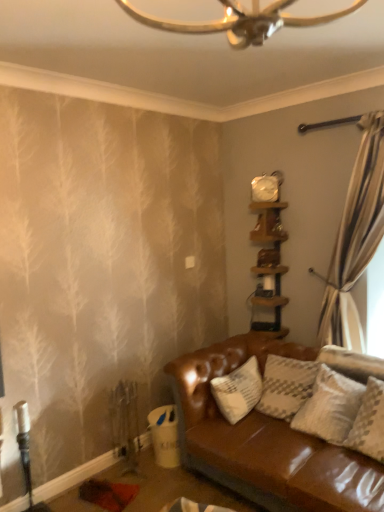
In order to click on white glossy clock at upper center in this screenshot , I will do `click(265, 188)`.

Which object is further away from the camera, wooden shelf at upper right, the second shelf positioned from the bottom, or white glossy clock at upper center?

white glossy clock at upper center is behind.

How different are the orientations of wooden shelf at upper right, the 1th shelf from the top, and white glossy clock at upper center in degrees?

The angular difference between wooden shelf at upper right, the 1th shelf from the top, and white glossy clock at upper center is 41.4 degrees.

Considering the relative sizes of wooden shelf at upper right, the second shelf positioned from the bottom, and white glossy clock at upper center in the image provided, is wooden shelf at upper right, the second shelf positioned from the bottom, thinner than white glossy clock at upper center?

In fact, wooden shelf at upper right, the second shelf positioned from the bottom, might be wider than white glossy clock at upper center.

Is point (277, 218) closer or farther from the camera than point (267, 185)?

Point (277, 218) is positioned farther from the camera compared to point (267, 185).

Considering the sizes of objects wooden shelf at upper right, the 1th shelf from the top, and wooden shelf at upper right, which is the first shelf from bottom to top, in the image provided, who is taller, wooden shelf at upper right, the 1th shelf from the top, or wooden shelf at upper right, which is the first shelf from bottom to top,?

Standing taller between the two is wooden shelf at upper right, which is the first shelf from bottom to top.

Is wooden shelf at upper right, the 1th shelf from the top, positioned with its back to wooden shelf at upper right, placed as the 2th shelf when sorted from top to bottom?

Correct, wooden shelf at upper right, the 1th shelf from the top, is looking away from wooden shelf at upper right, placed as the 2th shelf when sorted from top to bottom.

Is wooden shelf at upper right, the 1th shelf from the top, positioned far away from wooden shelf at upper right, placed as the 2th shelf when sorted from top to bottom?

No, wooden shelf at upper right, the 1th shelf from the top, is in close proximity to wooden shelf at upper right, placed as the 2th shelf when sorted from top to bottom.

Which object is wider, wooden shelf at upper right, the second shelf positioned from the bottom, or wooden shelf at upper right, placed as the 2th shelf when sorted from top to bottom?

Wider between the two is wooden shelf at upper right, placed as the 2th shelf when sorted from top to bottom.

Which of these two, wooden shelf at upper right, which is the first shelf from bottom to top, or wooden shelf at upper right, the second shelf positioned from the bottom, is bigger?

With larger size is wooden shelf at upper right, which is the first shelf from bottom to top.

Is wooden shelf at upper right, placed as the 2th shelf when sorted from top to bottom, in contact with wooden shelf at upper right, the 1th shelf from the top?

No.

Would you say wooden shelf at upper right, the 1th shelf from the top, is part of wooden shelf at upper right, placed as the 2th shelf when sorted from top to bottom,'s contents?

Yes, wooden shelf at upper right, placed as the 2th shelf when sorted from top to bottom, is surrounding wooden shelf at upper right, the 1th shelf from the top.

At what (x,y) coordinates should I click in order to perform the action: click on shelf above the wooden shelf at upper right, which is the first shelf from bottom to top (from the image's perspective). Please return your answer as a coordinate pair (x, y). This screenshot has height=512, width=384. Looking at the image, I should click on click(x=268, y=222).

Could you measure the distance between white glossy clock at upper center and wooden shelf at upper right, the 1th shelf from the top?

The distance of white glossy clock at upper center from wooden shelf at upper right, the 1th shelf from the top, is 5.49 inches.

Considering the sizes of objects white glossy clock at upper center and wooden shelf at upper right, the 1th shelf from the top, in the image provided, who is bigger, white glossy clock at upper center or wooden shelf at upper right, the 1th shelf from the top,?

With larger size is wooden shelf at upper right, the 1th shelf from the top.

From a real-world perspective, between white glossy clock at upper center and wooden shelf at upper right, the 1th shelf from the top, who is vertically higher?

white glossy clock at upper center, from a real-world perspective.

Is white glossy clock at upper center placed right next to wooden shelf at upper right, the 1th shelf from the top?

No, white glossy clock at upper center is not touching wooden shelf at upper right, the 1th shelf from the top.

Is wooden shelf at upper right, which is the first shelf from bottom to top, next to white glossy clock at upper center?

wooden shelf at upper right, which is the first shelf from bottom to top, and white glossy clock at upper center are clearly separated.

Which object is closer to the camera taking this photo, wooden shelf at upper right, placed as the 2th shelf when sorted from top to bottom, or white glossy clock at upper center?

wooden shelf at upper right, placed as the 2th shelf when sorted from top to bottom, is in front.

From the image's perspective, between wooden shelf at upper right, placed as the 2th shelf when sorted from top to bottom, and white glossy clock at upper center, which one is located above?

white glossy clock at upper center is shown above in the image.

The width and height of the screenshot is (384, 512). I want to click on clock on the left of the wooden shelf at upper right, which is the first shelf from bottom to top, so click(x=265, y=188).

What's the angular difference between white glossy clock at upper center and wooden shelf at upper right, which is the first shelf from bottom to top,'s facing directions?

white glossy clock at upper center and wooden shelf at upper right, which is the first shelf from bottom to top, are facing 40.6 degrees away from each other.

Between white glossy clock at upper center and wooden shelf at upper right, placed as the 2th shelf when sorted from top to bottom, which one is positioned behind?

white glossy clock at upper center.

From the image's perspective, which one is positioned lower, white glossy clock at upper center or wooden shelf at upper right, which is the first shelf from bottom to top?

From the image's view, wooden shelf at upper right, which is the first shelf from bottom to top, is below.

From a real-world perspective, which shelf is the 2nd one underneath the white glossy clock at upper center? Please provide its 2D coordinates.

[(269, 262)]

I want to click on clock located above the wooden shelf at upper right, the 1th shelf from the top (from a real-world perspective), so point(265,188).

The width and height of the screenshot is (384, 512). I want to click on shelf that is below the wooden shelf at upper right, the 1th shelf from the top (from the image's perspective), so click(269, 262).

Looking at the image, which one is located further to wooden shelf at upper right, placed as the 2th shelf when sorted from top to bottom, wooden shelf at upper right, the 1th shelf from the top, or white glossy clock at upper center?

white glossy clock at upper center is further to wooden shelf at upper right, placed as the 2th shelf when sorted from top to bottom.

Estimate the real-world distances between objects in this image. Which object is closer to wooden shelf at upper right, the 1th shelf from the top, white glossy clock at upper center or wooden shelf at upper right, which is the first shelf from bottom to top?

white glossy clock at upper center is closer to wooden shelf at upper right, the 1th shelf from the top.

Looking at the image, which one is located closer to wooden shelf at upper right, placed as the 2th shelf when sorted from top to bottom, white glossy clock at upper center or wooden shelf at upper right, the 1th shelf from the top?

The object closer to wooden shelf at upper right, placed as the 2th shelf when sorted from top to bottom, is wooden shelf at upper right, the 1th shelf from the top.

Looking at the image, which one is located further to white glossy clock at upper center, wooden shelf at upper right, which is the first shelf from bottom to top, or wooden shelf at upper right, the 1th shelf from the top?

wooden shelf at upper right, which is the first shelf from bottom to top, lies further to white glossy clock at upper center than the other object.

Estimate the real-world distances between objects in this image. Which object is further from white glossy clock at upper center, wooden shelf at upper right, the 1th shelf from the top, or wooden shelf at upper right, which is the first shelf from bottom to top?

The object further to white glossy clock at upper center is wooden shelf at upper right, which is the first shelf from bottom to top.

Estimate the real-world distances between objects in this image. Which object is further from wooden shelf at upper right, the 1th shelf from the top, wooden shelf at upper right, placed as the 2th shelf when sorted from top to bottom, or white glossy clock at upper center?

The object further to wooden shelf at upper right, the 1th shelf from the top, is wooden shelf at upper right, placed as the 2th shelf when sorted from top to bottom.

Locate an element on the screen. This screenshot has height=512, width=384. shelf that lies between white glossy clock at upper center and wooden shelf at upper right, which is the first shelf from bottom to top, from top to bottom is located at coordinates (268, 222).